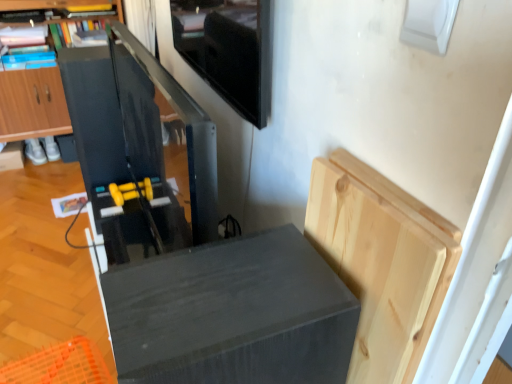
Question: Could you tell me if matte black speaker at lower center is turned towards matte black cabinet at left, the 1th cabinetry in the left-to-right sequence?

Choices:
 (A) no
 (B) yes

Answer: (A)

Question: Would you say matte black speaker at lower center contains matte black cabinet at left, arranged as the 1th cabinetry when viewed from the top?

Choices:
 (A) yes
 (B) no

Answer: (B)

Question: From the image's perspective, is matte black speaker at lower center on matte black cabinet at left, which is the 1th cabinetry in back-to-front order?

Choices:
 (A) no
 (B) yes

Answer: (A)

Question: From the image's perspective, is matte black speaker at lower center below matte black cabinet at left, arranged as the 1th cabinetry when viewed from the top?

Choices:
 (A) no
 (B) yes

Answer: (B)

Question: From a real-world perspective, does matte black speaker at lower center sit lower than matte black cabinet at left, arranged as the second cabinetry when viewed from the right?

Choices:
 (A) yes
 (B) no

Answer: (B)

Question: Considering the relative sizes of matte black speaker at lower center and matte black cabinet at left, the 2th cabinetry positioned from the front, in the image provided, is matte black speaker at lower center thinner than matte black cabinet at left, the 2th cabinetry positioned from the front,?

Choices:
 (A) yes
 (B) no

Answer: (A)

Question: Could you tell me if matte black cabinet at left, the second cabinetry ordered from the bottom, is turned towards natural wood cutting board at upper right, the first cabinetry from the right?

Choices:
 (A) no
 (B) yes

Answer: (B)

Question: Is matte black cabinet at left, the 1th cabinetry in the left-to-right sequence, wider than natural wood cutting board at upper right, the 1th cabinetry in the bottom-to-top sequence?

Choices:
 (A) no
 (B) yes

Answer: (B)

Question: Is natural wood cutting board at upper right, the 1th cabinetry in the bottom-to-top sequence, at the back of matte black cabinet at left, arranged as the 1th cabinetry when viewed from the top?

Choices:
 (A) no
 (B) yes

Answer: (A)

Question: Can you confirm if matte black cabinet at left, arranged as the second cabinetry when viewed from the right, is shorter than natural wood cutting board at upper right, positioned as the second cabinetry in back-to-front order?

Choices:
 (A) no
 (B) yes

Answer: (A)

Question: Considering the relative positions of matte black cabinet at left, arranged as the second cabinetry when viewed from the right, and natural wood cutting board at upper right, the 2th cabinetry positioned from the top, in the image provided, is matte black cabinet at left, arranged as the second cabinetry when viewed from the right, to the right of natural wood cutting board at upper right, the 2th cabinetry positioned from the top, from the viewer's perspective?

Choices:
 (A) yes
 (B) no

Answer: (B)

Question: Is matte black cabinet at left, arranged as the second cabinetry when viewed from the right, surrounding natural wood cutting board at upper right, which is the second cabinetry from left to right?

Choices:
 (A) yes
 (B) no

Answer: (B)

Question: Is natural wood cutting board at upper right, the 2th cabinetry positioned from the top, wider than matte black speaker at lower center?

Choices:
 (A) yes
 (B) no

Answer: (B)